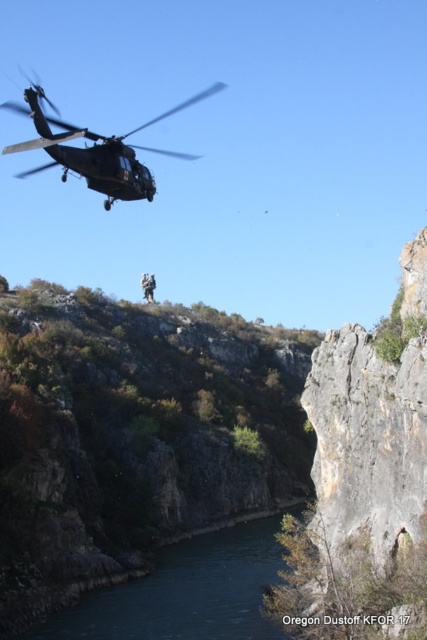
Does green leafy hillside at upper center have a greater width compared to blue smooth water at lower center?

Correct, the width of green leafy hillside at upper center exceeds that of blue smooth water at lower center.

Looking at this image, does green leafy hillside at upper center have a lesser width compared to blue smooth water at lower center?

In fact, green leafy hillside at upper center might be wider than blue smooth water at lower center.

Consider the image. Who is more distant from viewer, (177, 380) or (245, 588)?

Point (177, 380)

At what (x,y) coordinates should I click in order to perform the action: click on green leafy hillside at upper center. Please return your answer as a coordinate pair (x, y). Looking at the image, I should click on 134,435.

Between point (96, 145) and point (145, 291), which one is positioned in front?

Positioned in front is point (96, 145).

Does point (32, 99) lie behind point (148, 280)?

No, (32, 99) is in front of (148, 280).

You are a GUI agent. You are given a task and a screenshot of the screen. Output one action in this format:
    pyautogui.click(x=<x>, y=<y>)
    Task: Click on the matte black helicopter at upper left
    The height and width of the screenshot is (640, 427).
    Given the screenshot: What is the action you would take?
    pyautogui.click(x=96, y=148)

Which is in front, point (163, 348) or point (104, 147)?

Point (104, 147) is in front.

Does point (278, 444) lie behind point (37, 116)?

Yes, it is behind point (37, 116).

The image size is (427, 640). I want to click on green leafy hillside at upper center, so click(x=134, y=435).